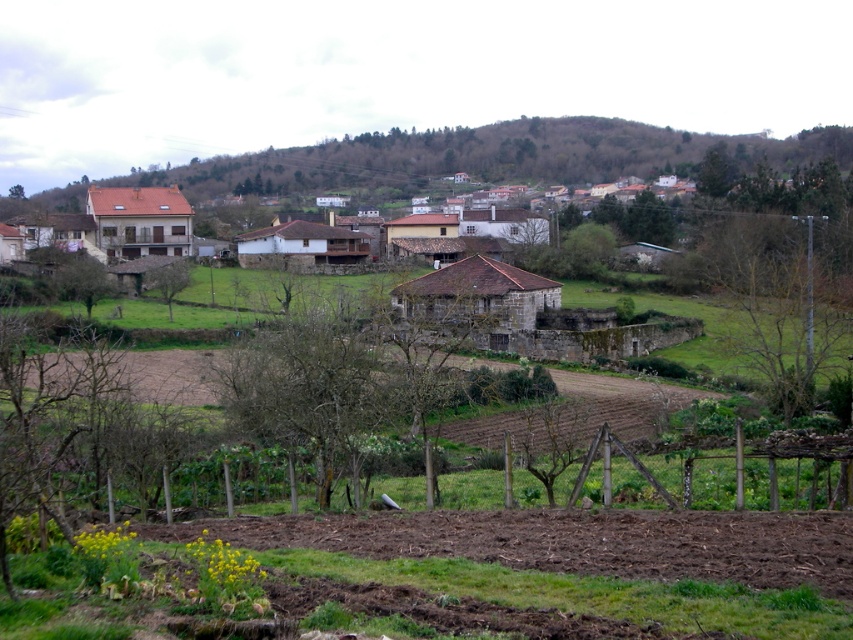
Question: Can you confirm if green leafy tree at right is wider than brown stone house at center?

Choices:
 (A) no
 (B) yes

Answer: (B)

Question: Which object appears farthest from the camera in this image?

Choices:
 (A) brown stone house at center
 (B) green leafy tree at center

Answer: (B)

Question: Estimate the real-world distances between objects in this image. Which object is closer to the green leafy tree at right?

Choices:
 (A) brown stone house at center
 (B) green leafy tree at center-left
 (C) green leafy tree at upper right
 (D) green leafy tree at center

Answer: (A)

Question: Can you confirm if green leafy tree at center-left is bigger than green leafy tree at center?

Choices:
 (A) no
 (B) yes

Answer: (B)

Question: Does green leafy tree at center-left appear on the right side of green leafy tree at upper right?

Choices:
 (A) no
 (B) yes

Answer: (A)

Question: Which object is the farthest from the brown stone house at center?

Choices:
 (A) green leafy tree at upper right
 (B) green leafy tree at center-left
 (C) green leafy tree at right

Answer: (A)